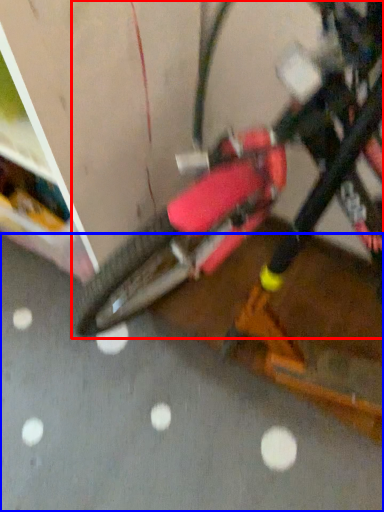
Question: Which point is closer to the camera, bicycle (highlighted by a red box) or concrete (highlighted by a blue box)?

Choices:
 (A) bicycle
 (B) concrete

Answer: (A)